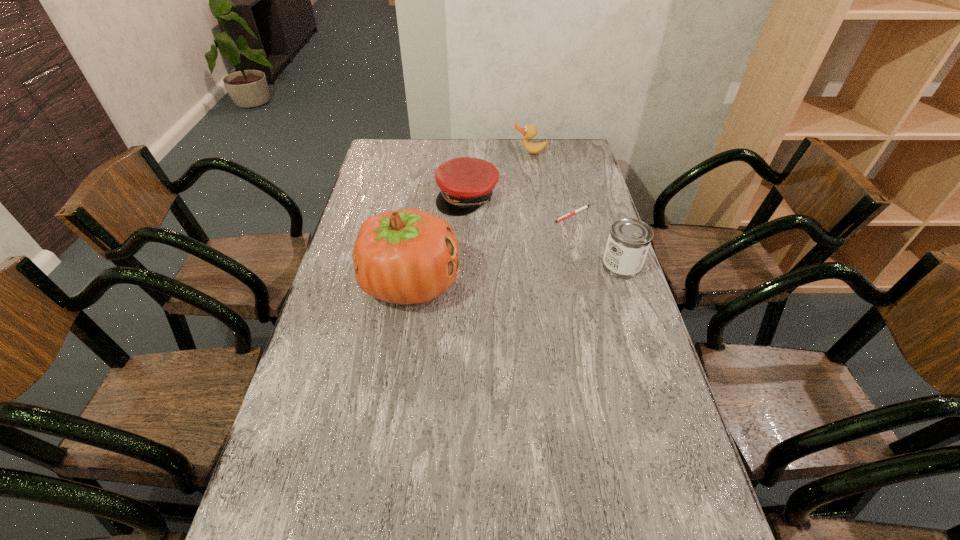
At what (x,y) coordinates should I click in order to perform the action: click on pumpkin. Please return your answer as a coordinate pair (x, y). Looking at the image, I should click on (408, 256).

I want to click on can, so click(629, 239).

Where is `the farthest object`? This screenshot has width=960, height=540. the farthest object is located at coordinates (529, 131).

At what (x,y) coordinates should I click in order to perform the action: click on pen. Please return your answer as a coordinate pair (x, y). Looking at the image, I should click on (584, 207).

Find the location of a particular element. cap is located at coordinates (466, 183).

This screenshot has height=540, width=960. What are the coordinates of `vacant area located 0.050m on the side of the tallest object with the cute face` in the screenshot? It's located at coord(346,283).

Find the location of a particular element. free location located on the left of the can is located at coordinates (562, 266).

Find the location of a particular element. Image resolution: width=960 pixels, height=540 pixels. vacant space located 0.300m on the beak of the farthest object is located at coordinates (529, 197).

You are a GUI agent. You are given a task and a screenshot of the screen. Output one action in this format:
    pyautogui.click(x=<x>, y=<y>)
    Task: Click on the blank area located 0.370m on the beak of the farthest object
    
    Given the screenshot: What is the action you would take?
    pyautogui.click(x=529, y=208)

I want to click on free space located on the beak of the farthest object, so tap(529, 201).